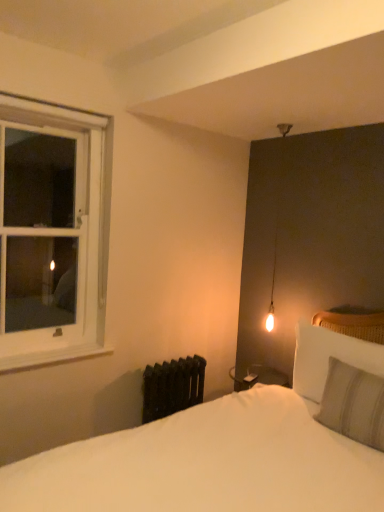
Question: From a real-world perspective, relative to black cast iron radiator at lower left, is gray striped pillow at right, the 2th pillow from the front, vertically above or below?

Choices:
 (A) above
 (B) below

Answer: (A)

Question: Is gray striped pillow at right, the 2th pillow from the front, bigger or smaller than black cast iron radiator at lower left?

Choices:
 (A) big
 (B) small

Answer: (A)

Question: Which object is positioned closest to the white soft bed at lower center?

Choices:
 (A) white painted wood at left
 (B) black cast iron radiator at lower left
 (C) light gray striped pillow at right, the first pillow viewed from the front
 (D) gray striped pillow at right, the first pillow when ordered from back to front
 (E) white wooden window at left

Answer: (C)

Question: Which of these objects is positioned farthest from the gray striped pillow at right, the 2th pillow from the front?

Choices:
 (A) white wooden window at left
 (B) white painted wood at left
 (C) light gray striped pillow at right, the first pillow viewed from the front
 (D) black cast iron radiator at lower left
 (E) white soft bed at lower center

Answer: (A)